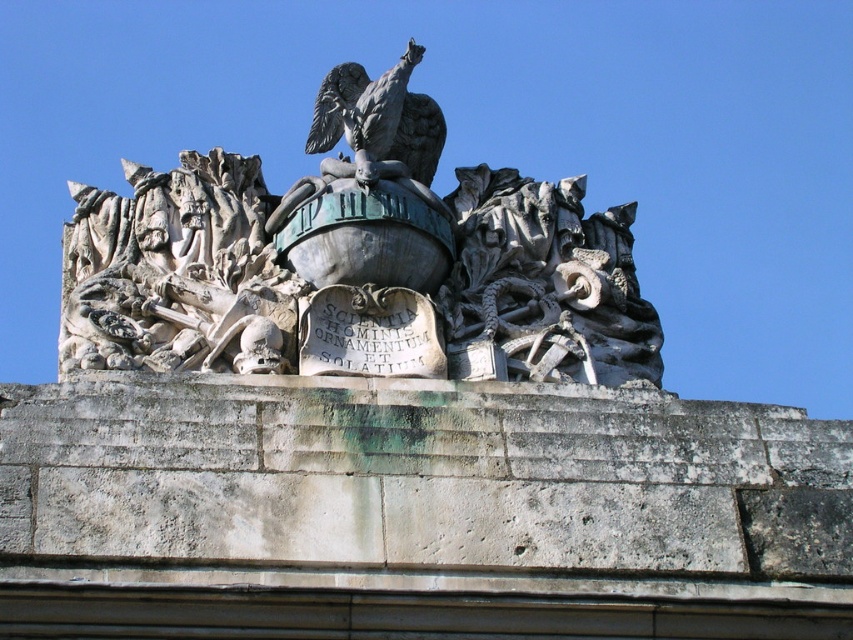
You are an art conservator assessing the stability of the white stone sculpture at upper center and the bronze eagle at upper center. Based on their positions, which object is more likely to be affected by direct sunlight first in the morning?

The bronze eagle at upper center is more likely to be affected by direct sunlight first because it is positioned above the white stone sculpture at upper center, placing it higher and closer to the sun.

You are an art conservator examining the sculpture. You notice the white stone sculpture at upper center and the bronze eagle at upper center. Which object is closer to you from your vantage point?

The white stone sculpture at upper center is closer to you because it is positioned in front of the bronze eagle at upper center.

You are standing in front of the architectural sculpture and notice two points marked on the structure. The first point is at coordinates point (x=361, y=141) and the second at point (x=426, y=170). Which point is closer to you?

Point (x=361, y=141) is in front of point (x=426, y=170), so it is closer to you.